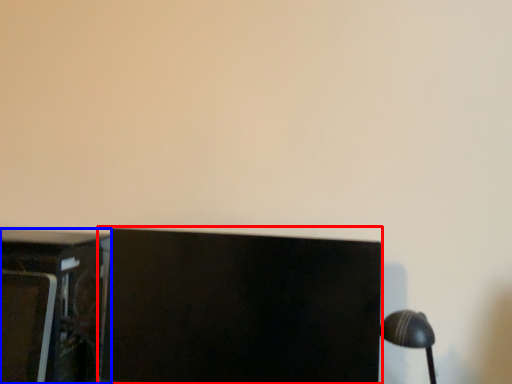
Question: Which object is further to the camera taking this photo, computer monitor (highlighted by a red box) or furniture (highlighted by a blue box)?

Choices:
 (A) computer monitor
 (B) furniture

Answer: (B)